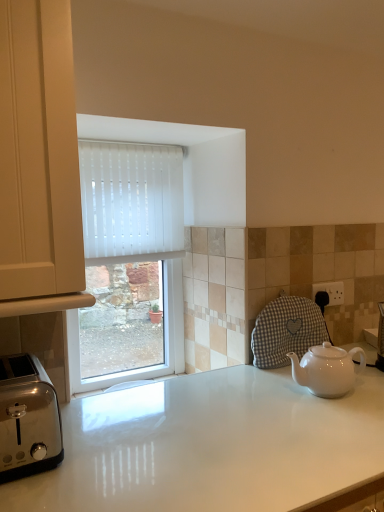
Question: Would you say white ceramic teapot at lower right is to the left or to the right of polished stainless steel toaster at lower left in the picture?

Choices:
 (A) left
 (B) right

Answer: (B)

Question: From a real-world perspective, is white ceramic teapot at lower right above or below polished stainless steel toaster at lower left?

Choices:
 (A) below
 (B) above

Answer: (A)

Question: Based on their relative distances, which object is farther from the polished stainless steel toaster at lower left?

Choices:
 (A) white glossy countertop at center
 (B) white ceramic teapot at lower right

Answer: (B)

Question: Which object is the closest to the polished stainless steel toaster at lower left?

Choices:
 (A) white ceramic teapot at lower right
 (B) white glossy countertop at center

Answer: (B)